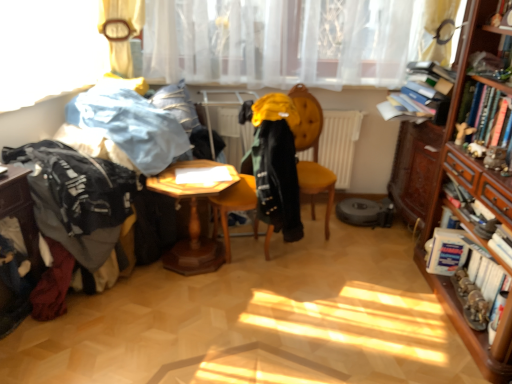
What are the coordinates of `hardcover book at right, the 1th book from the top` in the screenshot? It's located at (482, 116).

Locate an element on the screen. wooden drawer at right is located at coordinates (479, 184).

Locate an element on the screen. Image resolution: width=512 pixels, height=384 pixels. hardcover book at right, placed as the 1th book when sorted from bottom to top is located at coordinates (467, 273).

The width and height of the screenshot is (512, 384). What do you see at coordinates (21, 212) in the screenshot?
I see `wooden hexagonal table at lower left, the 1th table when ordered from left to right` at bounding box center [21, 212].

Measure the distance between yellow fabric swivel chair at center and camera.

yellow fabric swivel chair at center is 2.31 meters from camera.

At what (x,y) coordinates should I click in order to perform the action: click on denim jacket at left, the second clothing viewed from the right. Please return your answer as a coordinate pair (x, y). Looking at the image, I should click on (130, 124).

Where is `hardcover book at right, the 1th book from the top`? The image size is (512, 384). hardcover book at right, the 1th book from the top is located at coordinates pyautogui.click(x=482, y=116).

Which is closer, (432,211) or (505,100)?

Clearly, point (432,211) is more distant from the camera than point (505,100).

Where is `bookcase located below the hardcover book at right, the 2th book in the bottom-to-top sequence (from the image's perspective)`? The image size is (512, 384). bookcase located below the hardcover book at right, the 2th book in the bottom-to-top sequence (from the image's perspective) is located at coordinates [x=460, y=145].

From the image's perspective, is wooden bookcase at right below hardcover book at right, the 2th book in the bottom-to-top sequence?

Correct, wooden bookcase at right appears lower than hardcover book at right, the 2th book in the bottom-to-top sequence, in the image.

Considering the sizes of objects wooden bookcase at right and hardcover book at right, the 2th book in the bottom-to-top sequence, in the image provided, who is smaller, wooden bookcase at right or hardcover book at right, the 2th book in the bottom-to-top sequence,?

Smaller between the two is hardcover book at right, the 2th book in the bottom-to-top sequence.

Looking at this image, how different are the orientations of yellow fabric swivel chair at center and hardcover book at right, the 1th book from the top, in degrees?

yellow fabric swivel chair at center and hardcover book at right, the 1th book from the top, are facing 15.8 degrees away from each other.

From the image's perspective, which is below, yellow fabric swivel chair at center or hardcover book at right, the 2th book in the bottom-to-top sequence?

From the image's view, yellow fabric swivel chair at center is below.

Where is `the 2nd book in front of the yellow fabric swivel chair at center, counting from the anchor's position`? This screenshot has width=512, height=384. the 2nd book in front of the yellow fabric swivel chair at center, counting from the anchor's position is located at coordinates coord(482,116).

Consider the image. From a real-world perspective, which is physically above, yellow fabric swivel chair at center or hardcover book at right, the 1th book from the top?

hardcover book at right, the 1th book from the top.

Which object is thinner, wooden bookcase at right or wooden drawer at right?

Thinner between the two is wooden drawer at right.

Is wooden bookcase at right bigger than wooden drawer at right?

Indeed, wooden bookcase at right has a larger size compared to wooden drawer at right.

Which is behind, point (133, 125) or point (467, 111)?

The point (133, 125) is behind.

From a real-world perspective, does denim jacket at left, the second clothing viewed from the right, stand above hardcover book at right, the 2th book in the bottom-to-top sequence?

No, from a real-world perspective, denim jacket at left, the second clothing viewed from the right, is not over hardcover book at right, the 2th book in the bottom-to-top sequence

Are denim jacket at left, the 2th clothing in the left-to-right sequence, and hardcover book at right, the 2th book in the bottom-to-top sequence, making contact?

denim jacket at left, the 2th clothing in the left-to-right sequence, and hardcover book at right, the 2th book in the bottom-to-top sequence, are not in contact.

Between denim jacket at left, the 2th clothing in the left-to-right sequence, and hardcover book at right, the 1th book from the top, which one has smaller size?

hardcover book at right, the 1th book from the top, is smaller.

Does velvet yellow chair at center have a greater width compared to dark gray fabric at left, which is counted as the third clothing, starting from the right?

Incorrect, the width of velvet yellow chair at center does not surpass that of dark gray fabric at left, which is counted as the third clothing, starting from the right.

Between velvet yellow chair at center and dark gray fabric at left, the 1th clothing positioned from the left, which one has larger size?

velvet yellow chair at center.

Are velvet yellow chair at center and dark gray fabric at left, which is counted as the third clothing, starting from the right, far apart?

Indeed, velvet yellow chair at center is not near dark gray fabric at left, which is counted as the third clothing, starting from the right.

Could you tell me if velvet yellow chair at center is turned towards dark gray fabric at left, the 1th clothing positioned from the left?

No, velvet yellow chair at center is not facing towards dark gray fabric at left, the 1th clothing positioned from the left.

Considering the sizes of objects wooden hexagonal table at lower left, which is counted as the second table, starting from the right, and hardcover book at right, acting as the second book starting from the top, in the image provided, who is taller, wooden hexagonal table at lower left, which is counted as the second table, starting from the right, or hardcover book at right, acting as the second book starting from the top,?

With more height is wooden hexagonal table at lower left, which is counted as the second table, starting from the right.

From the image's perspective, is wooden hexagonal table at lower left, the 1th table when ordered from left to right, beneath hardcover book at right, placed as the 1th book when sorted from bottom to top?

Actually, wooden hexagonal table at lower left, the 1th table when ordered from left to right, appears above hardcover book at right, placed as the 1th book when sorted from bottom to top, in the image.

Is wooden hexagonal table at lower left, the 1th table when ordered from left to right, not within hardcover book at right, placed as the 1th book when sorted from bottom to top?

Yes.

Is point (33, 232) behind point (444, 266)?

No, it is not.

What's the angular difference between hardcover book at right, the 2th book in the bottom-to-top sequence, and velvet yellow chair at center's facing directions?

101 degrees.

From the image's perspective, which object appears higher, hardcover book at right, the 1th book from the top, or velvet yellow chair at center?

hardcover book at right, the 1th book from the top, from the image's perspective.

Considering the points (494, 118) and (332, 182), which point is in front, point (494, 118) or point (332, 182)?

Positioned in front is point (494, 118).

Does hardcover book at right, the 2th book in the bottom-to-top sequence, turn towards velvet yellow chair at center?

No, hardcover book at right, the 2th book in the bottom-to-top sequence, is not turned towards velvet yellow chair at center.

Find the location of a particular element. The height and width of the screenshot is (384, 512). the 1st book behind the wooden bookcase at right is located at coordinates (482, 116).

In the image, there is a hardcover book at right, the 1th book from the top. Find the location of `swivel chair below it (from a real-world perspective)`. swivel chair below it (from a real-world perspective) is located at coordinates (266, 174).

Consider the image. Based on their spatial positions, is velvet yellow chair at center or white matte radiator at center further from yellow fabric coat at center, the 1th clothing in the right-to-left sequence?

Among the two, white matte radiator at center is located further to yellow fabric coat at center, the 1th clothing in the right-to-left sequence.

Based on their spatial positions, is dark gray fabric at left, the 1th clothing positioned from the left, or denim jacket at left, the 2th clothing in the left-to-right sequence, closer to translucent white curtain at upper center?

The object closer to translucent white curtain at upper center is denim jacket at left, the 2th clothing in the left-to-right sequence.

Considering their positions, is wooden drawer at right positioned further to dark gray fabric at left, the 1th clothing positioned from the left, than white matte radiator at center?

wooden drawer at right lies further to dark gray fabric at left, the 1th clothing positioned from the left, than the other object.

Estimate the real-world distances between objects in this image. Which object is closer to velvet yellow chair at center, wooden bookcase at right or translucent white curtain at upper center?

Among the two, translucent white curtain at upper center is located nearer to velvet yellow chair at center.

Looking at the image, which one is located closer to wooden drawer at right, velvet yellow chair at center or yellow fabric swivel chair at center?

velvet yellow chair at center lies closer to wooden drawer at right than the other object.

When comparing their distances from hardcover book at right, placed as the 1th book when sorted from bottom to top, does velvet yellow chair at center or wooden hexagonal table at lower left, the 1th table when ordered from left to right, seem further?

Among the two, wooden hexagonal table at lower left, the 1th table when ordered from left to right, is located further to hardcover book at right, placed as the 1th book when sorted from bottom to top.

Consider the image. Considering their positions, is yellow fabric swivel chair at center positioned closer to wooden drawer at right than yellow fabric coat at center, the 3th clothing from the left?

yellow fabric coat at center, the 3th clothing from the left, lies closer to wooden drawer at right than the other object.

Estimate the real-world distances between objects in this image. Which object is closer to yellow fabric coat at center, the 1th clothing in the right-to-left sequence, dark gray fabric at left, which is counted as the third clothing, starting from the right, or wooden hexagonal table at center, marked as the second table in a left-to-right arrangement?

wooden hexagonal table at center, marked as the second table in a left-to-right arrangement, lies closer to yellow fabric coat at center, the 1th clothing in the right-to-left sequence, than the other object.

The image size is (512, 384). I want to click on table located between dark gray fabric at left, the 1th clothing positioned from the left, and hardcover book at right, the 2th book in the bottom-to-top sequence, in the left-right direction, so click(x=193, y=215).

Locate an element on the screen. chair between dark gray fabric at left, the 1th clothing positioned from the left, and hardcover book at right, the 1th book from the top, from left to right is located at coordinates (313, 148).

Identify the location of bookcase situated between wooden hexagonal table at center, which ranks as the 1th table in right-to-left order, and hardcover book at right, the 1th book from the top, from left to right. The height and width of the screenshot is (384, 512). (460, 145).

This screenshot has height=384, width=512. I want to click on swivel chair between denim jacket at left, the second clothing viewed from the right, and yellow fabric coat at center, the 1th clothing in the right-to-left sequence, from left to right, so pyautogui.click(x=266, y=174).